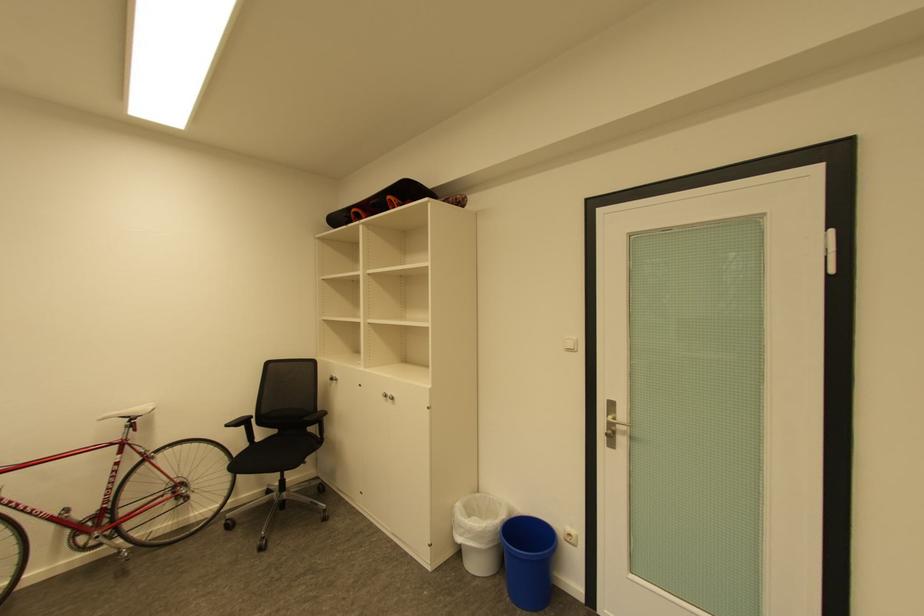
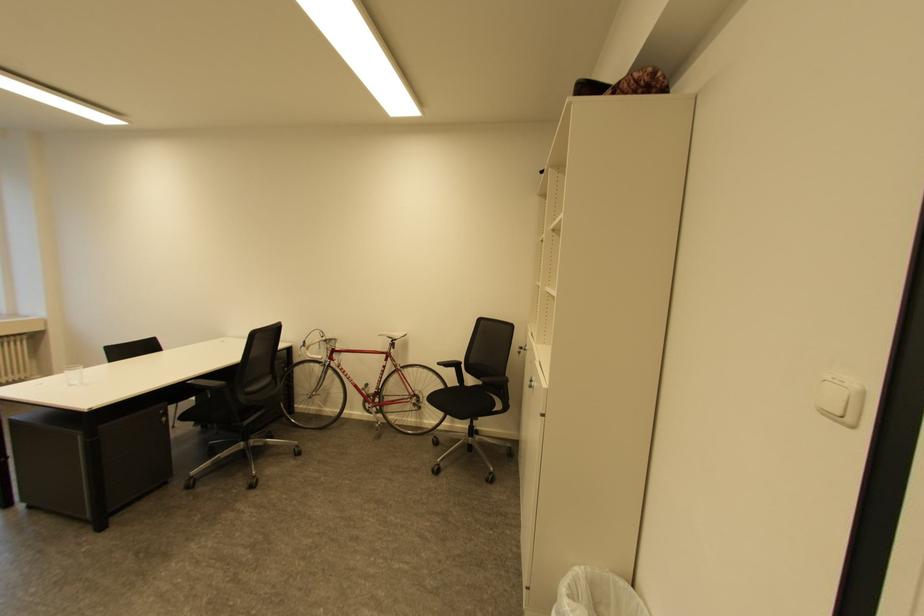
Where in the second image is the point corresponding to point (137, 418) from the first image?

(398, 339)